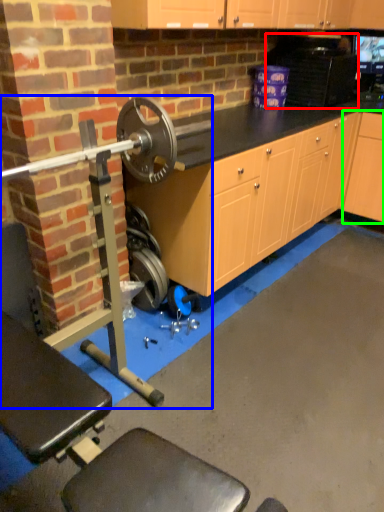
Question: Which object is positioned closest to appliance (highlighted by a red box)? Select from barbell (highlighted by a blue box) and cabinetry (highlighted by a green box).

Choices:
 (A) barbell
 (B) cabinetry

Answer: (B)